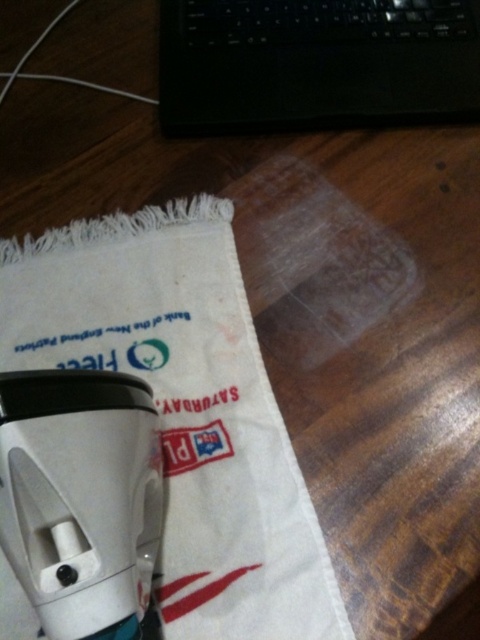
You are organizing items on a wooden table. You have a white cotton bag at center and a black plastic laptop at upper center. Which item is taller?

The white cotton bag at center is much taller than the black plastic laptop at upper center.

You are organizing items on a wooden table. You have a white cotton bag at center and a black plastic laptop at upper center. Which item takes up more space on the table?

The white cotton bag at center takes up more space on the table because it is bigger than the black plastic laptop at upper center.